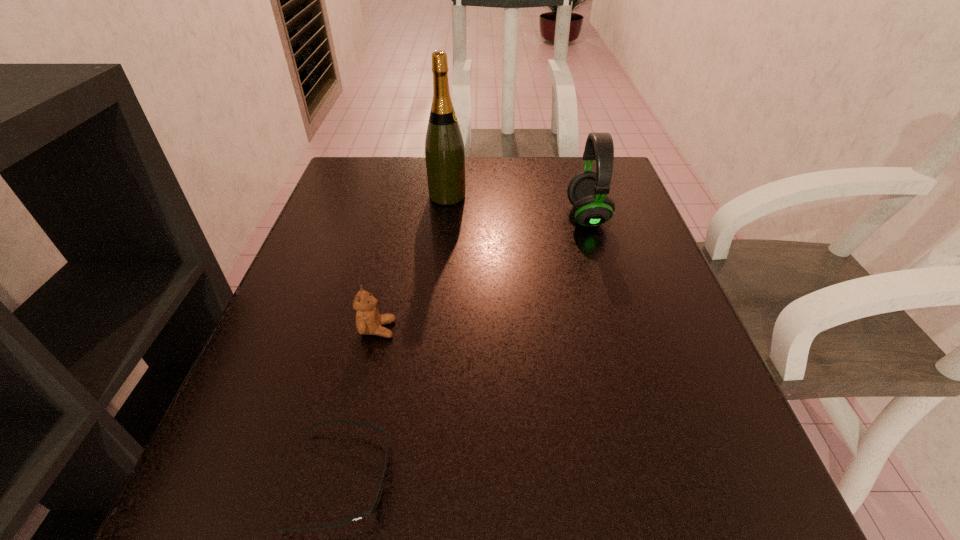
Locate an element on the screen. object present at the far right corner is located at coordinates (587, 191).

Locate an element on the screen. The height and width of the screenshot is (540, 960). vacant space at the far edge is located at coordinates (416, 161).

The width and height of the screenshot is (960, 540). In order to click on vacant point at the near edge in this screenshot , I will do `click(612, 489)`.

Where is `free point at the left edge`? The image size is (960, 540). free point at the left edge is located at coordinates (356, 237).

The image size is (960, 540). In the image, there is a desktop. Find the location of `vacant space at the right edge`. vacant space at the right edge is located at coordinates (708, 453).

Find the location of a particular element. vacant point at the far left corner is located at coordinates (353, 170).

Where is `vacant area that lies between the third shortest object and the second nearest object`? The width and height of the screenshot is (960, 540). vacant area that lies between the third shortest object and the second nearest object is located at coordinates (482, 272).

Image resolution: width=960 pixels, height=540 pixels. In order to click on vacant space in between the tallest object and the rightmost object in this screenshot , I will do `click(517, 206)`.

At what (x,y) coordinates should I click in order to perform the action: click on vacant space that is in between the wine bottle and the headset. Please return your answer as a coordinate pair (x, y). This screenshot has height=540, width=960. Looking at the image, I should click on (517, 206).

Where is `vacant space that is in between the tallest object and the third farthest object`? This screenshot has width=960, height=540. vacant space that is in between the tallest object and the third farthest object is located at coordinates (413, 262).